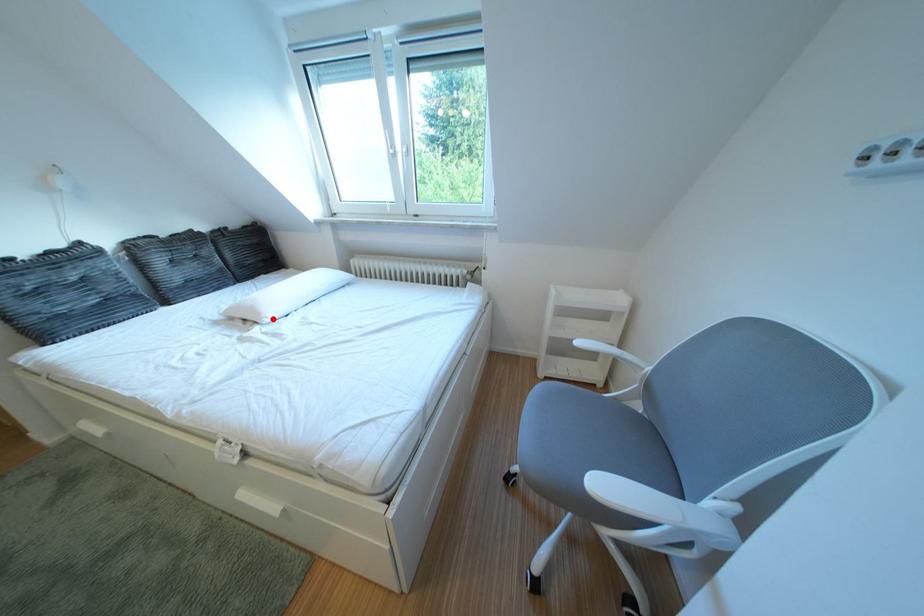
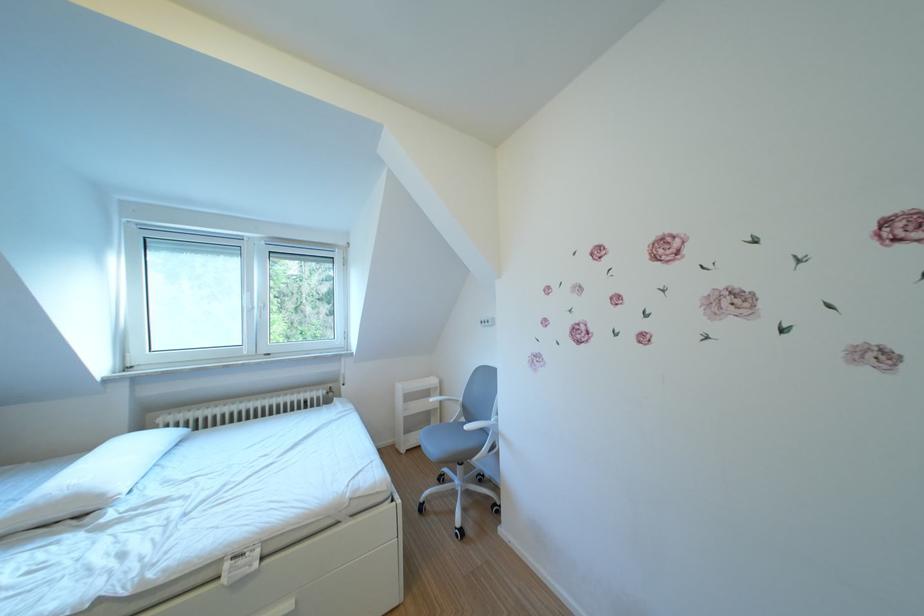
In the second image, find the point that corresponds to the highlighted location in the first image.

(115, 501)